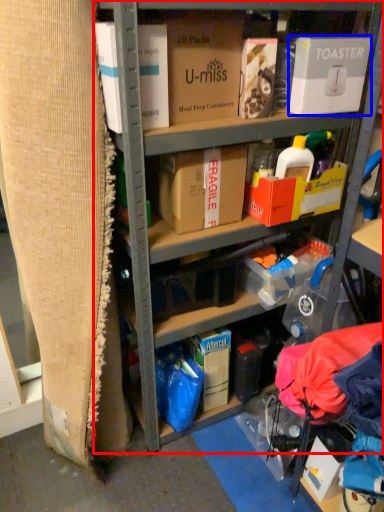
Question: Which point is further to the camera, shelf (highlighted by a red box) or box (highlighted by a blue box)?

Choices:
 (A) shelf
 (B) box

Answer: (B)